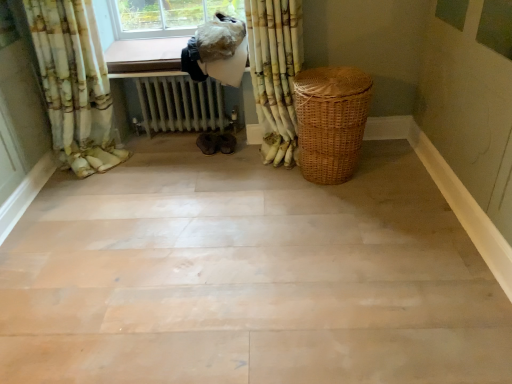
The image size is (512, 384). Identify the location of vacant space that is to the left of white textured curtain at upper right, placed as the 1th curtain when sorted from right to left. (225, 169).